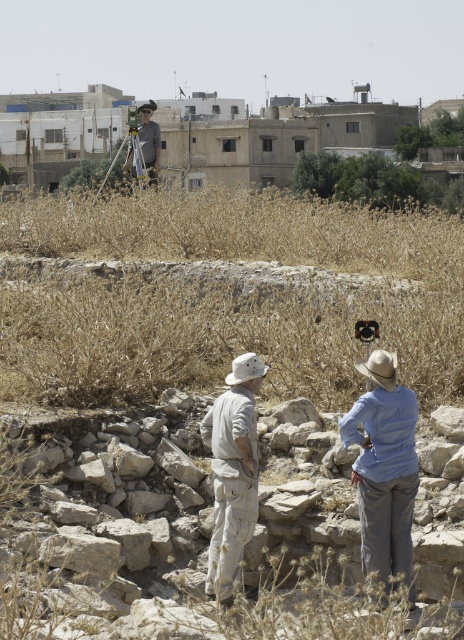
You are planning to place a new object between the tan canvas hat at center and the matte black tripod at upper center. Given their sizes, which object should be placed closer to the smaller one to ensure stability?

The tan canvas hat at center is smaller than the matte black tripod at upper center, so placing the new object closer to the tan canvas hat at center would provide better stability due to its smaller base.